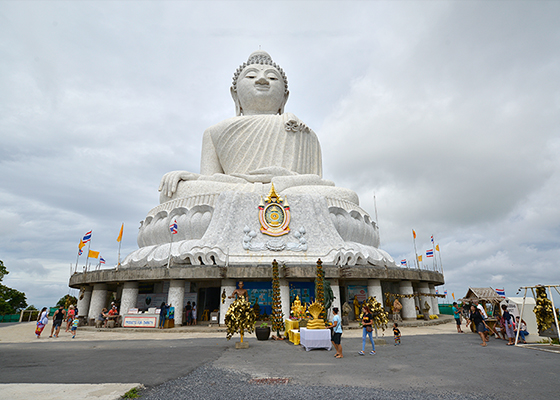
Identify the location of statue base. Image resolution: width=560 pixels, height=400 pixels. (236, 200).